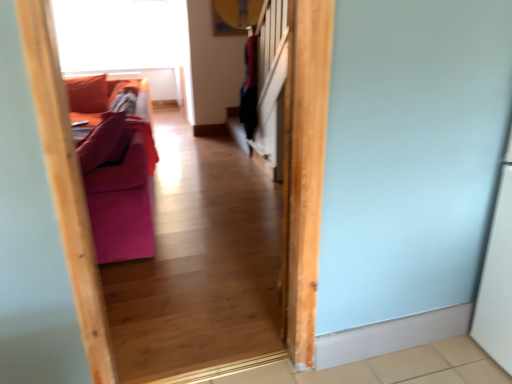
Question: Considering the positions of transparent glass window screen at upper left and matte purple couch at left in the image, is transparent glass window screen at upper left taller or shorter than matte purple couch at left?

Choices:
 (A) short
 (B) tall

Answer: (B)

Question: From a real-world perspective, relative to matte purple couch at left, is transparent glass window screen at upper left vertically above or below?

Choices:
 (A) below
 (B) above

Answer: (B)

Question: Is point (128, 26) positioned closer to the camera than point (97, 178)?

Choices:
 (A) farther
 (B) closer

Answer: (A)

Question: Is point (91, 140) closer or farther from the camera than point (145, 9)?

Choices:
 (A) farther
 (B) closer

Answer: (B)

Question: Looking at their shapes, would you say matte purple couch at left is wider or thinner than transparent glass window screen at upper left?

Choices:
 (A) wide
 (B) thin

Answer: (A)

Question: Considering their positions, is matte purple couch at left located in front of or behind transparent glass window screen at upper left?

Choices:
 (A) front
 (B) behind

Answer: (A)

Question: From their relative heights in the image, would you say matte purple couch at left is taller or shorter than transparent glass window screen at upper left?

Choices:
 (A) short
 (B) tall

Answer: (A)